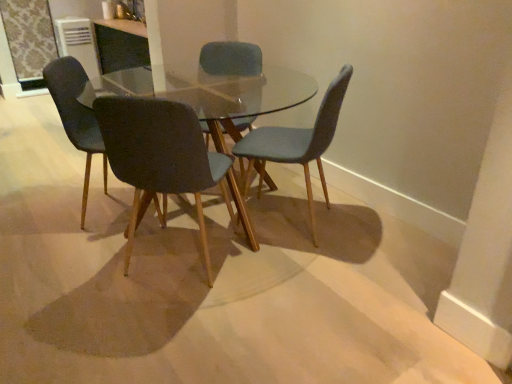
At what (x,y) coordinates should I click in order to perform the action: click on vacant area situated to the left side of matte black chair at left, arranged as the first chair when viewed from the left. Please return your answer as a coordinate pair (x, y). The width and height of the screenshot is (512, 384). Looking at the image, I should click on (47, 210).